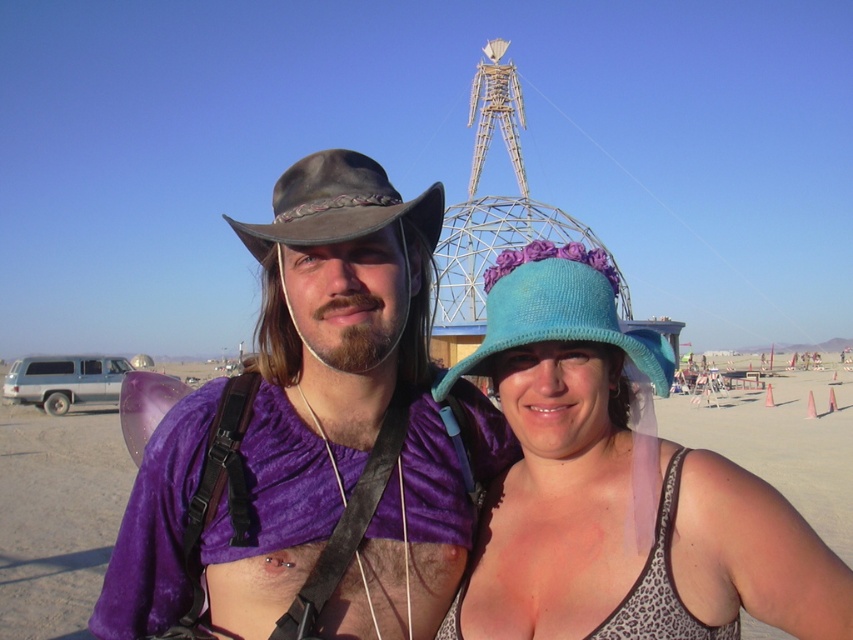
You are standing at the point labeled point (541, 570) and want to walk to the point labeled point (317, 166). Given that both points are in the desert environment shown, which direction should you head to reach your destination?

Since point (541, 570) is closer to the viewer than point (317, 166), you should walk away from the viewer to reach point (317, 166).

You are a photographer trying to capture a group photo of the blue knitted hat at center and the turquoise knitted hat at center. The camera you have can only focus on objects within 5 meters. Will both hats be in focus?

The distance between the blue knitted hat at center and the turquoise knitted hat at center is 5.47 meters, which is beyond the camera focus range of 5 meters. Therefore, both hats cannot be in focus simultaneously.

You are a photographer adjusting the focus on your camera. You need to focus on either the point at (682, 506) or the point at (529, 301). Which point should you focus on if you want the closest object in the scene to be sharp?

You should focus on point (682, 506) because it is closer to the camera than point (529, 301), making it the closer object in the scene.